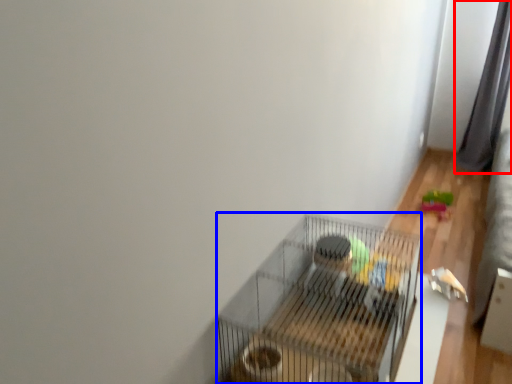
Question: Which object appears farthest to the camera in this image, curtain (highlighted by a red box) or bird cage (highlighted by a blue box)?

Choices:
 (A) curtain
 (B) bird cage

Answer: (A)